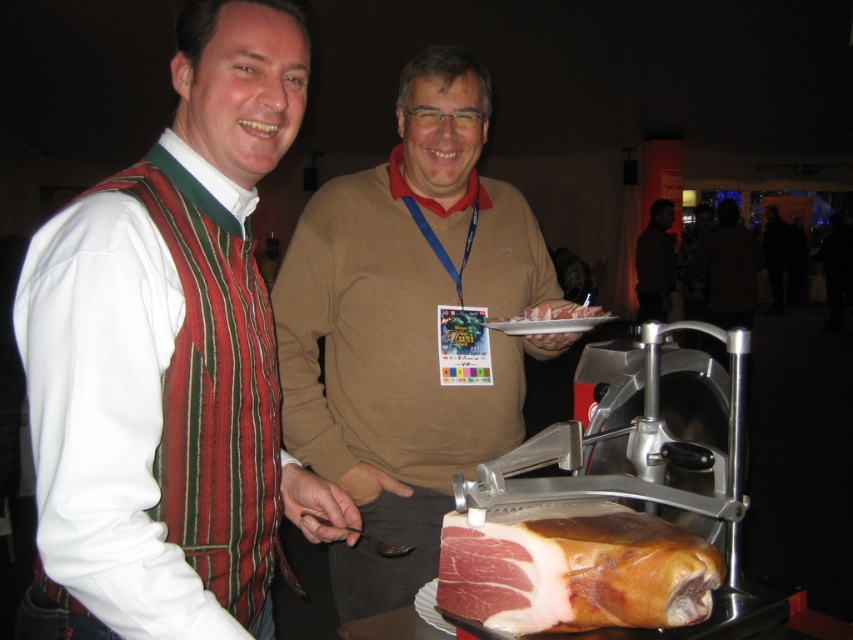
This screenshot has width=853, height=640. What do you see at coordinates (408, 326) in the screenshot?
I see `matte brown sweater at center` at bounding box center [408, 326].

Is point (286, 372) positioned behind point (546, 316)?

Yes, point (286, 372) is behind point (546, 316).

Which is in front, point (421, 396) or point (567, 307)?

Point (567, 307) is more forward.

This screenshot has width=853, height=640. Find the location of `matte brown sweater at center`. matte brown sweater at center is located at coordinates (408, 326).

Does brown fabric shirt at center have a larger size compared to pinkish raw meat at center?

Indeed, brown fabric shirt at center has a larger size compared to pinkish raw meat at center.

Which is behind, point (735, 316) or point (535, 317)?

The point (735, 316) is more distant.

Locate an element on the screen. The height and width of the screenshot is (640, 853). brown fabric shirt at center is located at coordinates click(x=728, y=269).

Is pinkish-red cured meat at center positioned behind dark brown leather jacket at upper right?

No.

From the picture: Does pinkish-red cured meat at center come in front of dark brown leather jacket at upper right?

Yes, pinkish-red cured meat at center is closer to the viewer.

The image size is (853, 640). What do you see at coordinates (575, 570) in the screenshot?
I see `pinkish-red cured meat at center` at bounding box center [575, 570].

You are a GUI agent. You are given a task and a screenshot of the screen. Output one action in this format:
    pyautogui.click(x=<x>, y=<y>)
    Task: Click on the pinkish-red cured meat at center
    
    Given the screenshot: What is the action you would take?
    pyautogui.click(x=575, y=570)